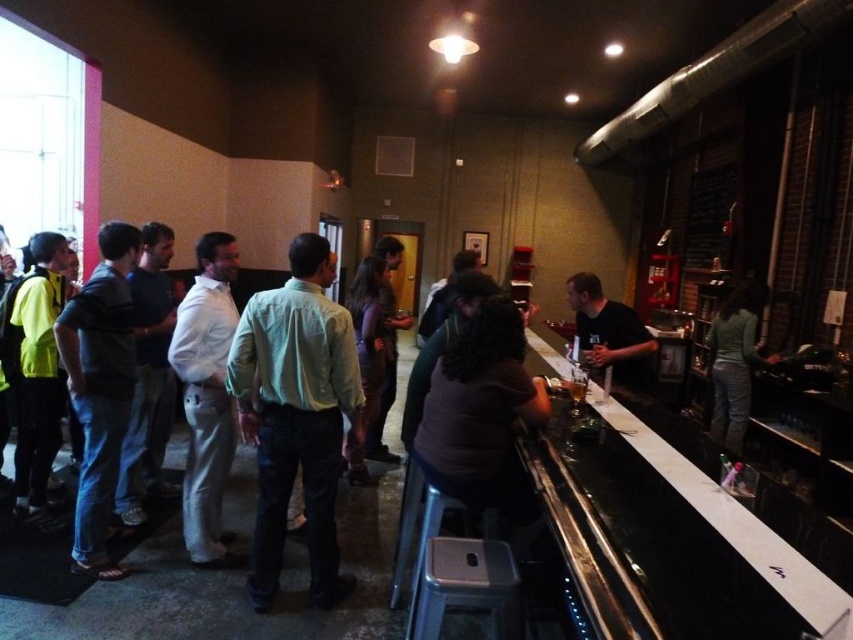
Does white cotton shirt at center have a smaller size compared to translucent glass beer at bar counter?

No, white cotton shirt at center is not smaller than translucent glass beer at bar counter.

Is point (196, 259) positioned before point (579, 406)?

No, it is not.

Locate an element on the screen. This screenshot has height=640, width=853. white cotton shirt at center is located at coordinates (206, 396).

Does black matte shirt at bar have a smaller size compared to translucent glass at bar counter?

Actually, black matte shirt at bar might be larger than translucent glass at bar counter.

Which is in front, point (608, 305) or point (578, 400)?

Point (578, 400) is in front.

Does point (627, 305) come in front of point (572, 397)?

No, it is not.

Locate an element on the screen. Image resolution: width=853 pixels, height=640 pixels. black matte shirt at bar is located at coordinates click(608, 332).

Identify the location of dark brown leather jacket at bar. (480, 413).

Can you confirm if dark brown leather jacket at bar is smaller than translucent glass beer at bar counter?

Actually, dark brown leather jacket at bar might be larger than translucent glass beer at bar counter.

Is point (473, 470) more distant than point (576, 381)?

No, it is in front of (576, 381).

Where is `dark brown leather jacket at bar`? The height and width of the screenshot is (640, 853). dark brown leather jacket at bar is located at coordinates (480, 413).